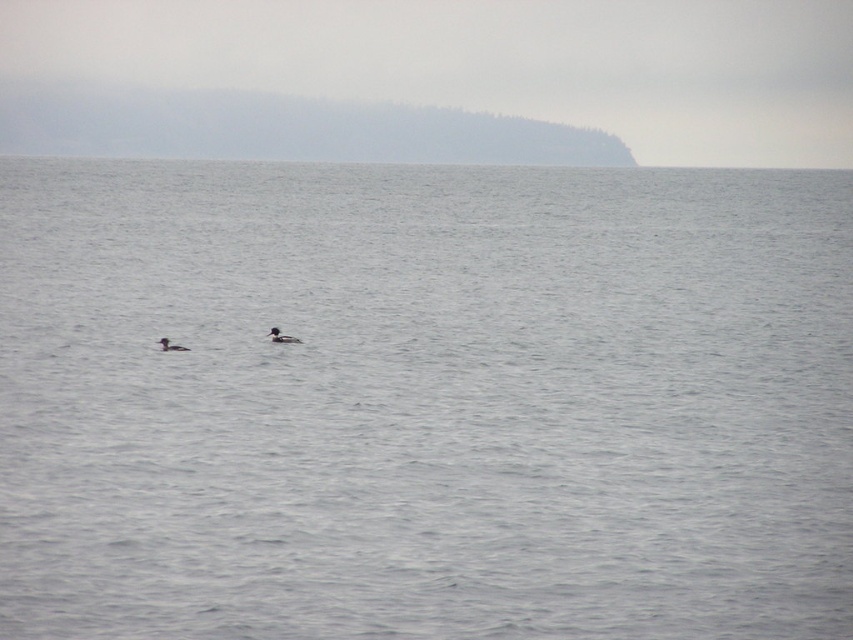
Can you confirm if brown matte duck at center is positioned below dark brown duck at center?

Actually, brown matte duck at center is above dark brown duck at center.

Is point (276, 337) closer to viewer compared to point (180, 346)?

No, (276, 337) is behind (180, 346).

At what (x,y) coordinates should I click in order to perform the action: click on brown matte duck at center. Please return your answer as a coordinate pair (x, y). Looking at the image, I should click on (281, 337).